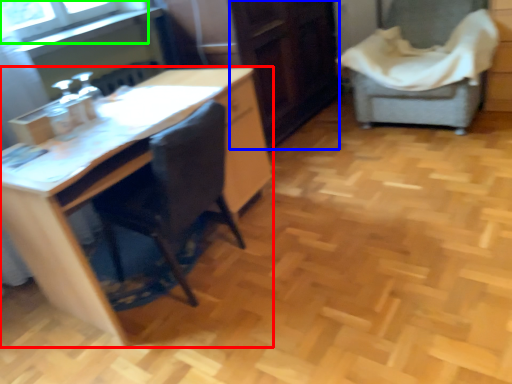
Question: Which object is positioned closest to desk (highlighted by a red box)? Select from file cabinet (highlighted by a blue box) and window screen (highlighted by a green box).

Choices:
 (A) file cabinet
 (B) window screen

Answer: (B)